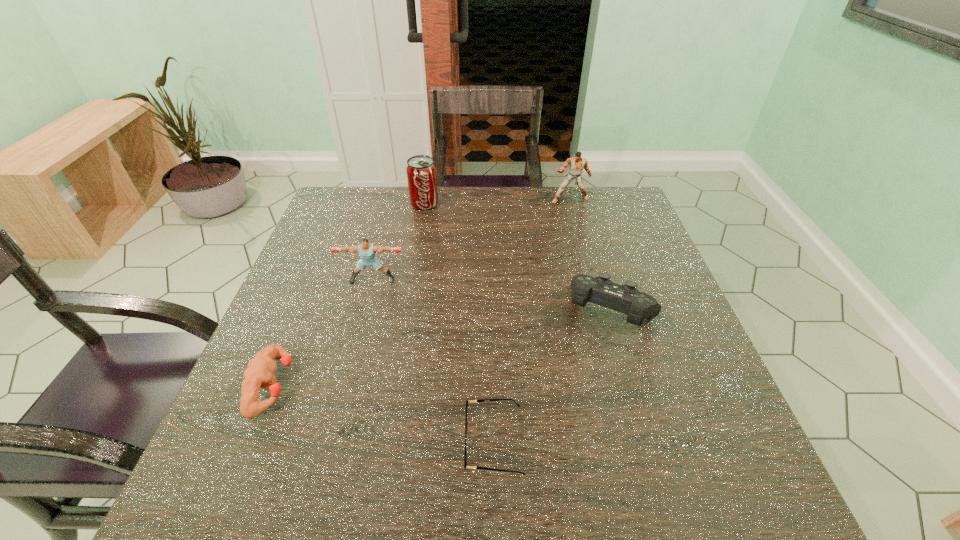
This screenshot has width=960, height=540. In order to click on the tallest puncher in this screenshot , I will do `click(577, 164)`.

The width and height of the screenshot is (960, 540). I want to click on the farthest puncher, so click(577, 164).

At what (x,y) coordinates should I click in order to perform the action: click on pop soda. Please return your answer as a coordinate pair (x, y). The height and width of the screenshot is (540, 960). Looking at the image, I should click on (421, 171).

The height and width of the screenshot is (540, 960). What are the coordinates of `the second farthest puncher` in the screenshot? It's located at (366, 250).

Identify the location of the second shortest puncher. This screenshot has height=540, width=960. (366, 250).

Find the location of a particular element. control is located at coordinates (600, 290).

This screenshot has height=540, width=960. What are the coordinates of `the shortest puncher` in the screenshot? It's located at (260, 370).

The image size is (960, 540). I want to click on the second shortest object, so click(260, 370).

Find the location of `the shortest object`. the shortest object is located at coordinates (465, 463).

At what (x,y) coordinates should I click in order to perform the action: click on the fourth object from left to right. Please return your answer as a coordinate pair (x, y). The height and width of the screenshot is (540, 960). Looking at the image, I should click on (465, 463).